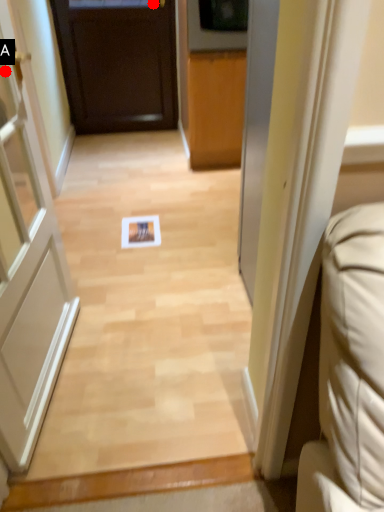
Question: Two points are circled on the image, labeled by A and B beside each circle. Among these points, which one is nearest to the camera?

Choices:
 (A) A is closer
 (B) B is closer

Answer: (A)